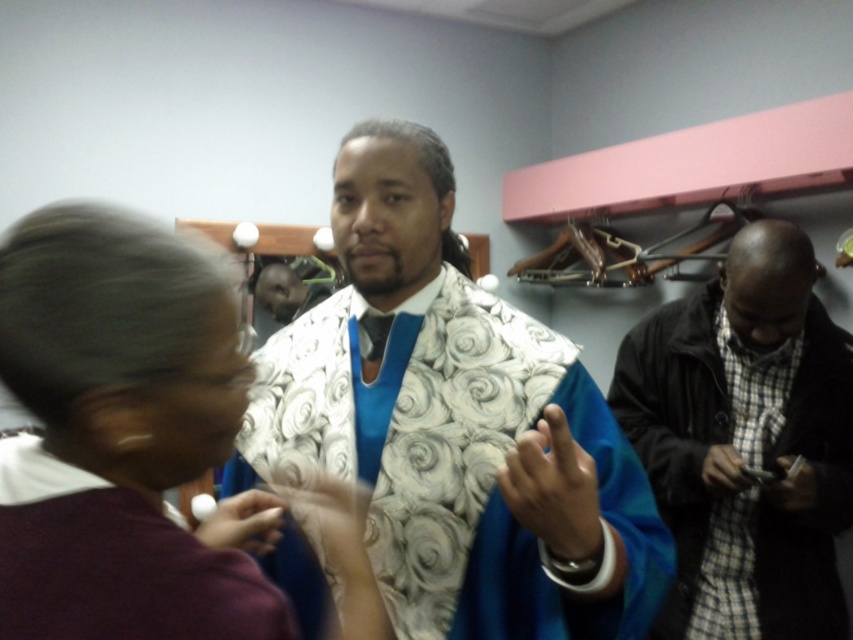
You are standing in a store and see two points marked on the wall. The first point is at coordinate point (316, 403) and the second is at point (665, 401). Which point is closer to you?

Point (316, 403) is closer to the viewer than point (665, 401).